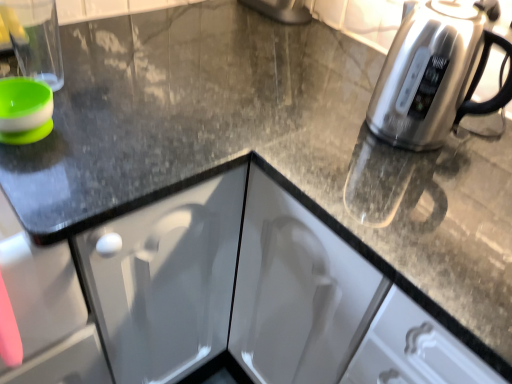
I want to click on spots to the right of transparent plastic cup at upper left, so click(x=129, y=75).